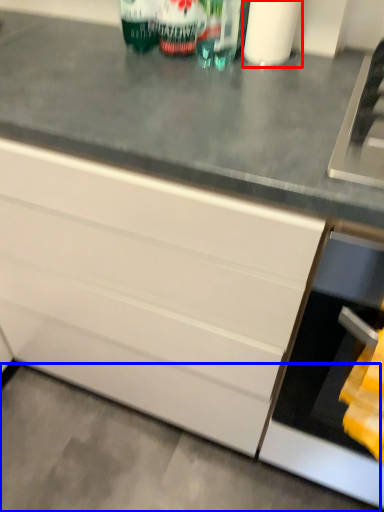
Question: Among these objects, which one is farthest to the camera, toilet paper (highlighted by a red box) or concrete (highlighted by a blue box)?

Choices:
 (A) toilet paper
 (B) concrete

Answer: (B)